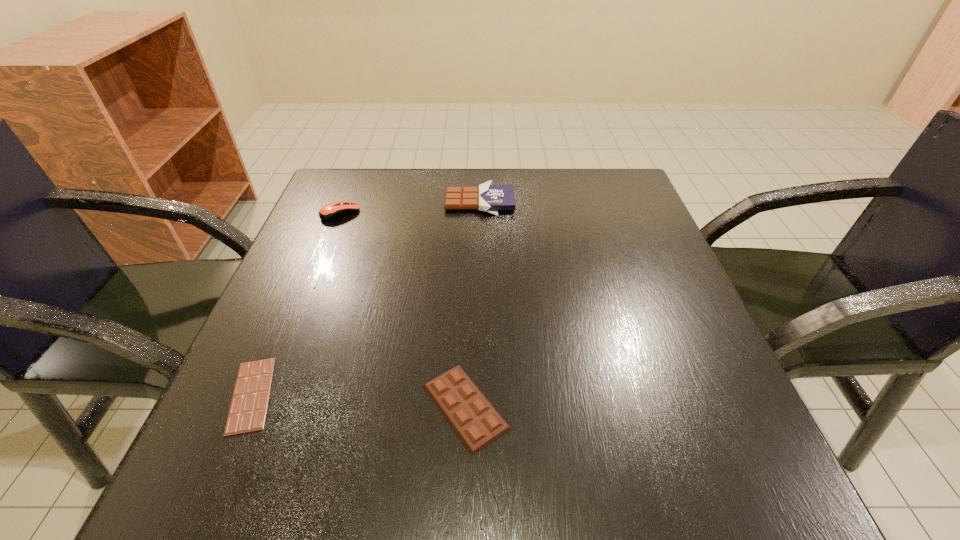
Find the location of `vacant area that lies between the farthest chocolate bar and the shortest object`. vacant area that lies between the farthest chocolate bar and the shortest object is located at coordinates (366, 298).

Identify the location of free space between the tallest chocolate bar and the computer mouse. (410, 207).

Identify which object is located as the nearest to the shortest chocolate bar. Please provide its 2D coordinates. Your answer should be formatted as a tuple, i.e. [(x, y)], where the tuple contains the x and y coordinates of a point satisfying the conditions above.

[(476, 422)]

Locate which object is the closest to the farthest chocolate bar. Please provide its 2D coordinates. Your answer should be formatted as a tuple, i.e. [(x, y)], where the tuple contains the x and y coordinates of a point satisfying the conditions above.

[(333, 211)]

Identify which chocolate bar is the third nearest to the computer mouse. Please provide its 2D coordinates. Your answer should be formatted as a tuple, i.e. [(x, y)], where the tuple contains the x and y coordinates of a point satisfying the conditions above.

[(476, 422)]

Locate which chocolate bar is the second closest to the computer mouse. Please provide its 2D coordinates. Your answer should be formatted as a tuple, i.e. [(x, y)], where the tuple contains the x and y coordinates of a point satisfying the conditions above.

[(249, 404)]

The width and height of the screenshot is (960, 540). Find the location of `free space that satisfies the following two spatial constraints: 1. on the back side of the tallest chocolate bar; 2. on the left side of the computer mouse`. free space that satisfies the following two spatial constraints: 1. on the back side of the tallest chocolate bar; 2. on the left side of the computer mouse is located at coordinates (345, 202).

The height and width of the screenshot is (540, 960). I want to click on vacant space that satisfies the following two spatial constraints: 1. on the back side of the second shortest object; 2. on the left side of the farthest chocolate bar, so click(x=470, y=202).